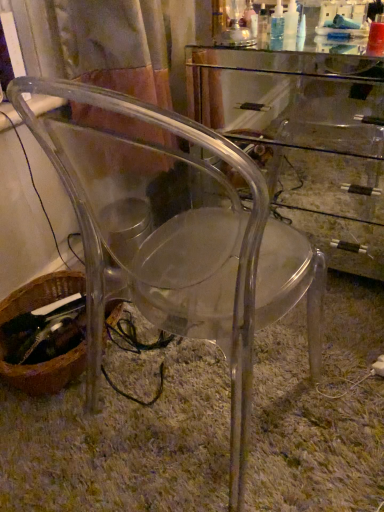
Question: Considering the relative sizes of transparent acrylic computer desk at center and brown woven basket at lower left in the image provided, is transparent acrylic computer desk at center taller than brown woven basket at lower left?

Choices:
 (A) no
 (B) yes

Answer: (B)

Question: Is transparent acrylic computer desk at center at the right side of brown woven basket at lower left?

Choices:
 (A) no
 (B) yes

Answer: (B)

Question: From a real-world perspective, does transparent acrylic computer desk at center sit lower than brown woven basket at lower left?

Choices:
 (A) no
 (B) yes

Answer: (A)

Question: Is transparent acrylic computer desk at center behind brown woven basket at lower left?

Choices:
 (A) no
 (B) yes

Answer: (A)

Question: Is there a large distance between transparent acrylic computer desk at center and brown woven basket at lower left?

Choices:
 (A) yes
 (B) no

Answer: (A)

Question: Could you tell me if transparent acrylic computer desk at center is facing brown woven basket at lower left?

Choices:
 (A) yes
 (B) no

Answer: (A)

Question: Considering the relative positions of brown woven basket at lower left and transparent acrylic chair at center in the image provided, is brown woven basket at lower left to the left of transparent acrylic chair at center from the viewer's perspective?

Choices:
 (A) yes
 (B) no

Answer: (A)

Question: From the image's perspective, is brown woven basket at lower left on transparent acrylic chair at center?

Choices:
 (A) no
 (B) yes

Answer: (A)

Question: Is brown woven basket at lower left shorter than transparent acrylic chair at center?

Choices:
 (A) no
 (B) yes

Answer: (B)

Question: Would you consider brown woven basket at lower left to be distant from transparent acrylic chair at center?

Choices:
 (A) no
 (B) yes

Answer: (A)

Question: From the image's perspective, is brown woven basket at lower left located beneath transparent acrylic chair at center?

Choices:
 (A) no
 (B) yes

Answer: (B)

Question: Is brown woven basket at lower left positioned behind transparent acrylic chair at center?

Choices:
 (A) no
 (B) yes

Answer: (B)

Question: Is brown woven basket at lower left completely or partially outside of transparent acrylic computer desk at center?

Choices:
 (A) no
 (B) yes

Answer: (B)